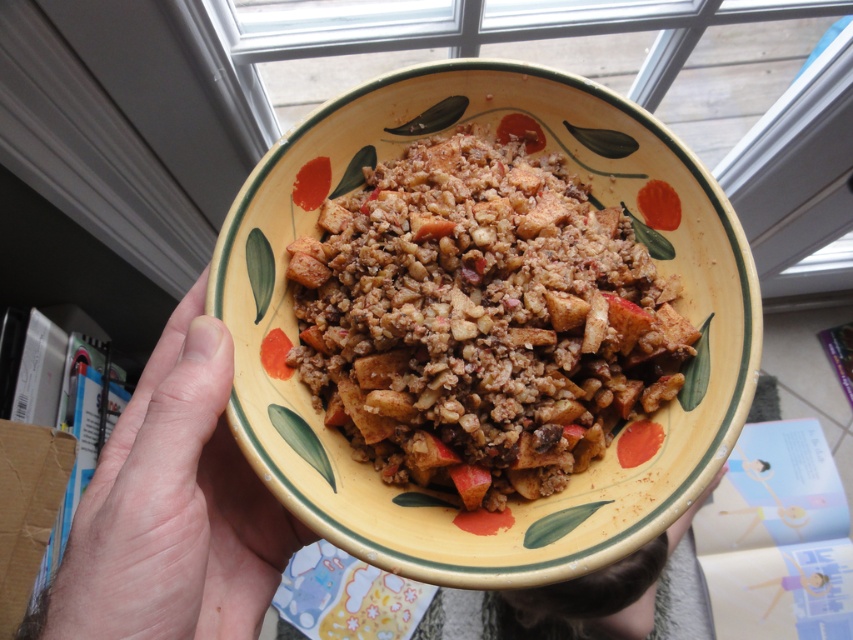
Question: Does pale skin at lower left have a smaller size compared to yellow matte bowl at center?

Choices:
 (A) no
 (B) yes

Answer: (B)

Question: Among these objects, which one is farthest from the camera?

Choices:
 (A) matte brown crumble at center
 (B) pale skin at lower left

Answer: (A)

Question: Is matte brown crumble at center positioned in front of yellow matte bowl at center?

Choices:
 (A) no
 (B) yes

Answer: (A)

Question: Can you confirm if pale skin at lower left is smaller than yellow matte bowl at center?

Choices:
 (A) yes
 (B) no

Answer: (A)

Question: Which point is farther from the camera taking this photo?

Choices:
 (A) (96, 573)
 (B) (0, 484)

Answer: (B)

Question: Among these objects, which one is farthest from the camera?

Choices:
 (A) yellow matte bowl at center
 (B) matte brown crumble at center
 (C) pale skin at lower left

Answer: (B)